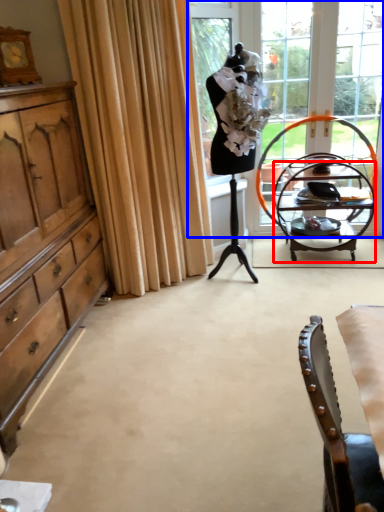
Question: Which point is further to the camera, desk (highlighted by a red box) or window (highlighted by a blue box)?

Choices:
 (A) desk
 (B) window

Answer: (B)